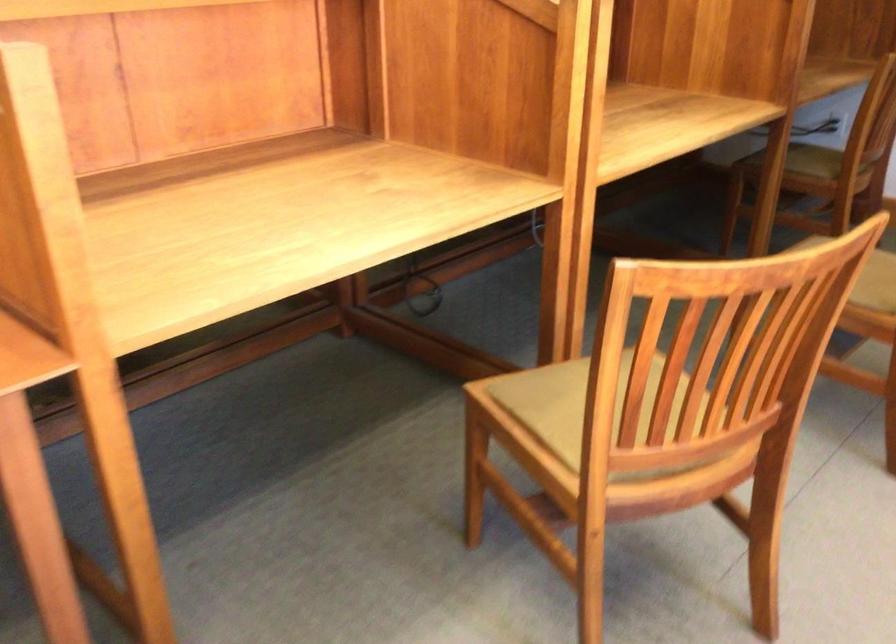
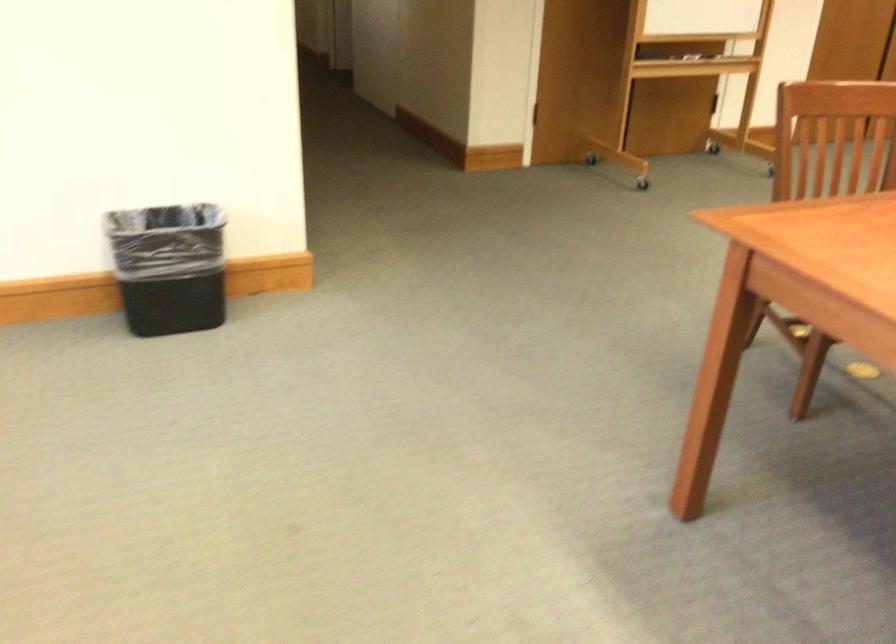
The first image is from the beginning of the video and the second image is from the end. How did the camera likely rotate when shooting the video?

The rotation direction of the camera is left-down.